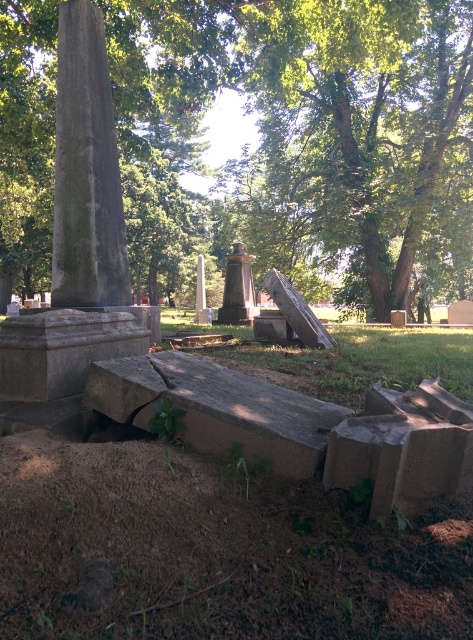
Question: Is smooth gray stone at lower center bigger than polished bronze statue at center?

Choices:
 (A) no
 (B) yes

Answer: (A)

Question: Can you confirm if smooth gray stone pillar at center is wider than smooth gray stone obelisk at center?

Choices:
 (A) no
 (B) yes

Answer: (A)

Question: Can you confirm if green rough bark tree at upper left is smaller than smooth gray stone pillar at center?

Choices:
 (A) no
 (B) yes

Answer: (A)

Question: Among these points, which one is nearest to the camera?

Choices:
 (A) (230, 298)
 (B) (201, 300)
 (C) (236, 192)

Answer: (A)

Question: Which of these objects is positioned closest to the smooth gray stone obelisk at center?

Choices:
 (A) smooth gray stone at center
 (B) polished bronze statue at center

Answer: (B)

Question: Which point is closer to the camera?

Choices:
 (A) (198, 301)
 (B) (79, 173)
 (C) (402, 497)
 (D) (297, 433)

Answer: (C)